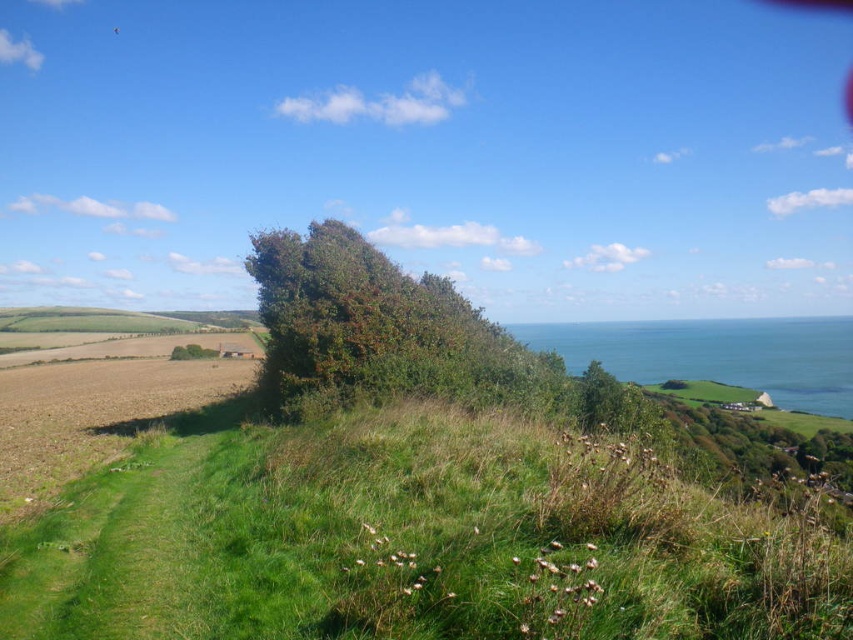
Question: Among these objects, which one is nearest to the camera?

Choices:
 (A) green leafy bush at center
 (B) green grassy hillside at center

Answer: (B)

Question: Does green grassy hillside at center appear on the left side of green leafy bush at center?

Choices:
 (A) yes
 (B) no

Answer: (A)

Question: Is green grassy hillside at center further to camera compared to green leafy bush at center?

Choices:
 (A) no
 (B) yes

Answer: (A)

Question: Does green grassy hillside at center appear on the left side of green leafy bush at center?

Choices:
 (A) yes
 (B) no

Answer: (A)